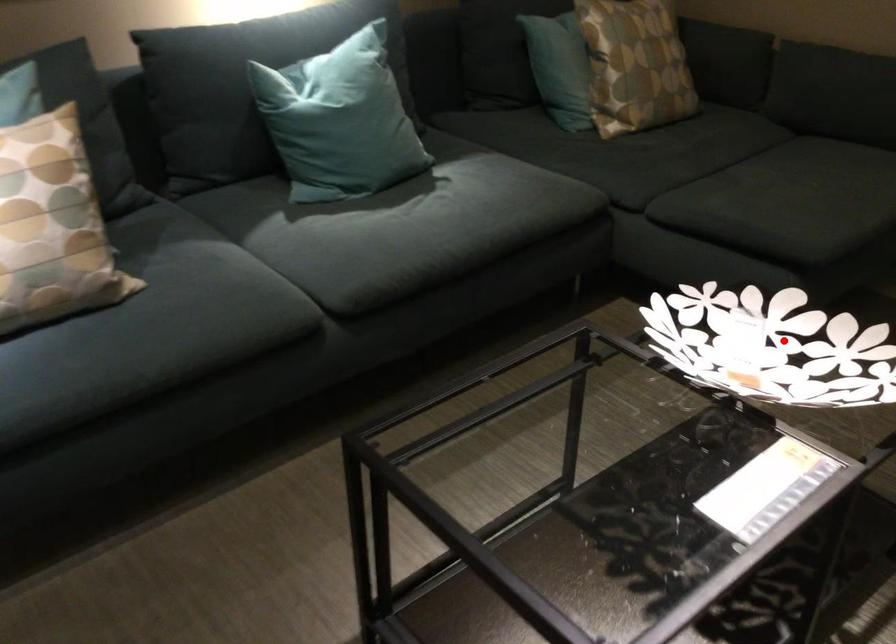
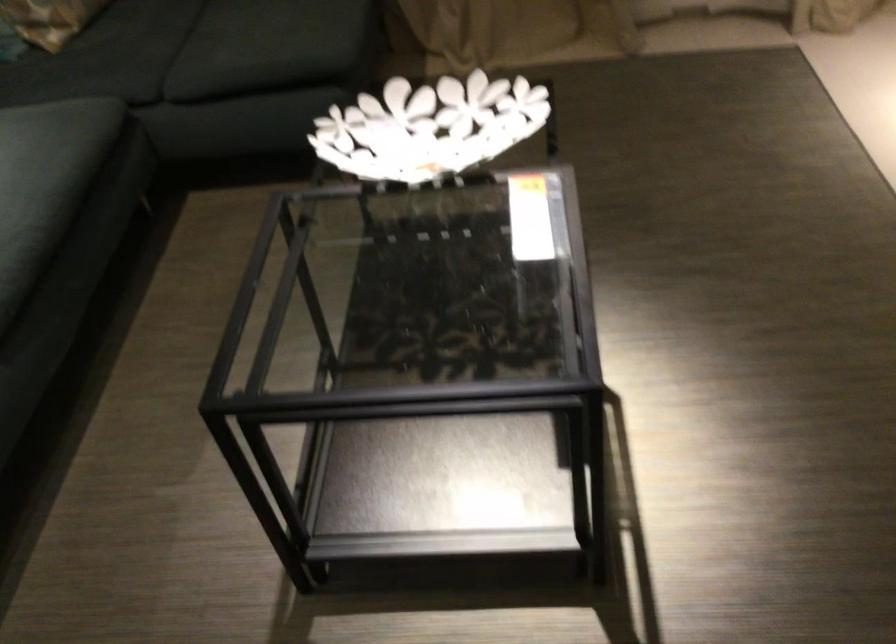
Question: I am providing you with two images of the same scene from different viewpoints. In image1, a red point is highlighted. Considering the same 3D point in image2, which of the following is correct?

Choices:
 (A) It is closer
 (B) It is farther

Answer: (B)